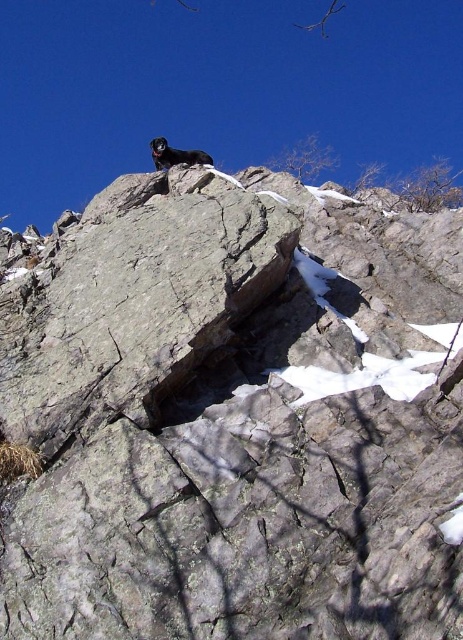
You are a photographer planning to take a photo of the gray rough rock at upper center and the black fur dog at upper center. Based on their heights, which object should you focus on first if you want to ensure both are in focus?

The gray rough rock at upper center is shorter than the black fur dog at upper center. To ensure both are in focus, you should focus on the black fur dog at upper center first since it is taller and will require adjusting the focus to include the shorter rock.

You are a hiker trying to reach the summit. You see a gray rough rock at upper center and a black fur dog at upper center. Which object is lower in elevation?

The gray rough rock at upper center is positioned under the black fur dog at upper center, so the gray rough rock at upper center is lower in elevation.

You are a photographer trying to capture the black fur dog at upper center and the gray rough rock at upper center in the same frame. Which object takes up more space in the image?

The black fur dog at upper center takes up more space in the image than the gray rough rock at upper center because the gray rough rock at upper center occupies less space than black fur dog at upper center.